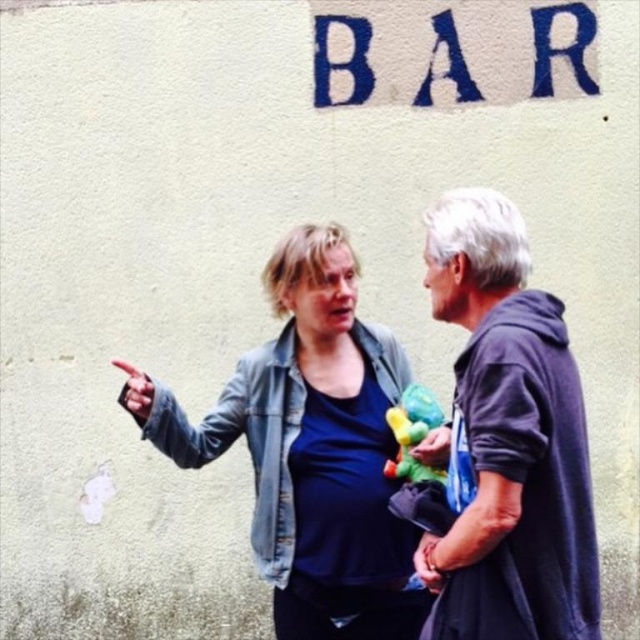
Question: Which point is closer to the camera taking this photo?

Choices:
 (A) (412, 429)
 (B) (557, 547)
 (C) (172, 422)

Answer: (B)

Question: Is the position of denim jacket at upper left more distant than that of dark gray hoodie at right?

Choices:
 (A) no
 (B) yes

Answer: (B)

Question: Is denim jacket at upper left positioned in front of dark gray hoodie at right?

Choices:
 (A) no
 (B) yes

Answer: (A)

Question: Which of the following is the farthest from the observer?

Choices:
 (A) dark gray hoodie at right
 (B) multicolored plush toy at center
 (C) denim jacket at upper left

Answer: (C)

Question: Can you confirm if dark gray hoodie at right is positioned to the left of multicolored plush toy at center?

Choices:
 (A) no
 (B) yes

Answer: (A)

Question: Considering the real-world distances, which object is closest to the multicolored plush toy at center?

Choices:
 (A) denim jacket at upper left
 (B) dark gray hoodie at right

Answer: (A)